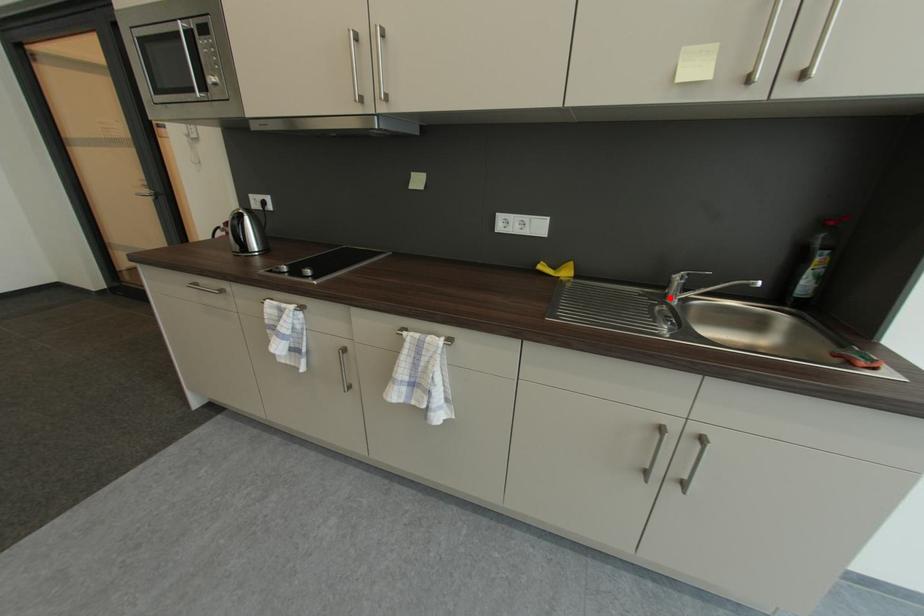
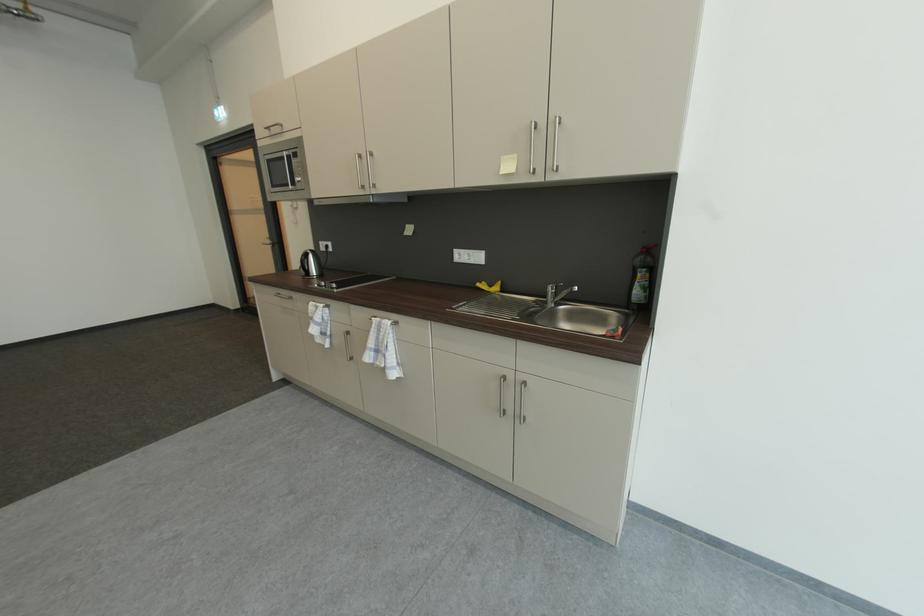
In the second image, find the point that corresponds to the highlighted location in the first image.

(553, 304)